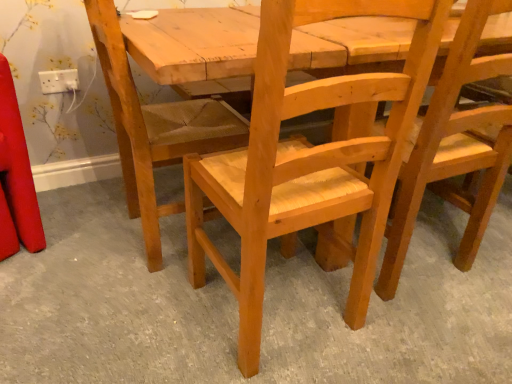
The width and height of the screenshot is (512, 384). Find the location of `vacant area that is situated to the right of natural wood chair at center, the second chair when ordered from left to right`. vacant area that is situated to the right of natural wood chair at center, the second chair when ordered from left to right is located at coordinates (419, 332).